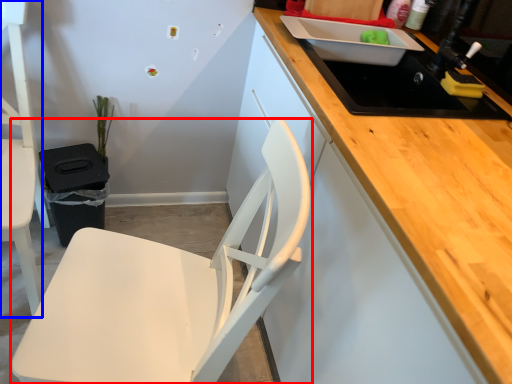
Question: Which point is closer to the camera, chair (highlighted by a red box) or chair (highlighted by a blue box)?

Choices:
 (A) chair
 (B) chair

Answer: (A)